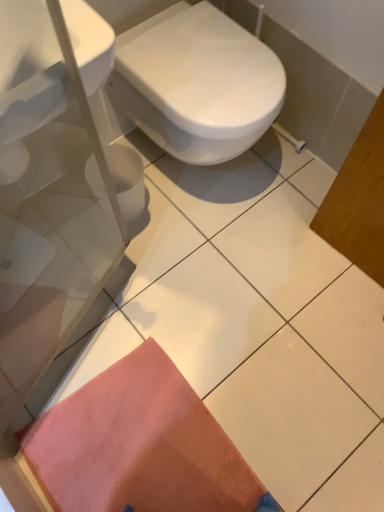
Question: From a real-world perspective, is white glossy sink at upper left positioned over orange textured mat at lower left based on gravity?

Choices:
 (A) yes
 (B) no

Answer: (A)

Question: Is white glossy sink at upper left thinner than orange textured mat at lower left?

Choices:
 (A) no
 (B) yes

Answer: (B)

Question: Can you confirm if white glossy sink at upper left is positioned to the left of orange textured mat at lower left?

Choices:
 (A) no
 (B) yes

Answer: (B)

Question: Is white glossy sink at upper left positioned far away from orange textured mat at lower left?

Choices:
 (A) yes
 (B) no

Answer: (B)

Question: Does white glossy sink at upper left appear on the right side of orange textured mat at lower left?

Choices:
 (A) yes
 (B) no

Answer: (B)

Question: Is point (97, 59) positioned closer to the camera than point (67, 455)?

Choices:
 (A) closer
 (B) farther

Answer: (A)

Question: From the image's perspective, is white glossy sink at upper left above or below orange textured mat at lower left?

Choices:
 (A) above
 (B) below

Answer: (A)

Question: Based on their positions, is white glossy sink at upper left located to the left or right of orange textured mat at lower left?

Choices:
 (A) right
 (B) left

Answer: (B)

Question: Considering the positions of white glossy sink at upper left and orange textured mat at lower left in the image, is white glossy sink at upper left wider or thinner than orange textured mat at lower left?

Choices:
 (A) thin
 (B) wide

Answer: (A)

Question: In terms of size, does orange textured mat at lower left appear bigger or smaller than white glossy bidet at center?

Choices:
 (A) big
 (B) small

Answer: (B)

Question: Would you say orange textured mat at lower left is to the left or to the right of white glossy bidet at center in the picture?

Choices:
 (A) left
 (B) right

Answer: (A)

Question: From their relative heights in the image, would you say orange textured mat at lower left is taller or shorter than white glossy bidet at center?

Choices:
 (A) tall
 (B) short

Answer: (B)

Question: From a real-world perspective, is orange textured mat at lower left physically located above or below white glossy bidet at center?

Choices:
 (A) above
 (B) below

Answer: (B)

Question: Visually, is orange textured mat at lower left positioned to the left or to the right of white glossy sink at upper left?

Choices:
 (A) left
 (B) right

Answer: (B)

Question: Considering the positions of orange textured mat at lower left and white glossy sink at upper left in the image, is orange textured mat at lower left taller or shorter than white glossy sink at upper left?

Choices:
 (A) short
 (B) tall

Answer: (A)